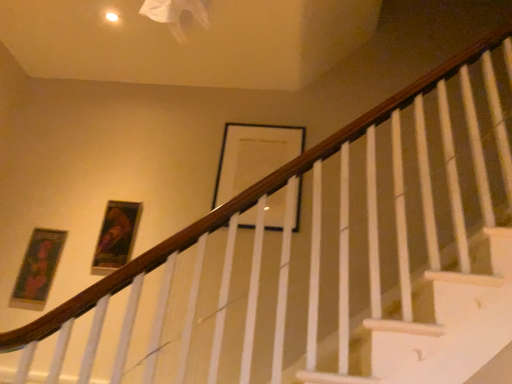
Question: Looking at the image, does black matte picture frame at upper center, which is counted as the third picture frame, starting from the left, seem bigger or smaller compared to matte gold picture frame at left, the first picture frame in the left-to-right sequence?

Choices:
 (A) small
 (B) big

Answer: (B)

Question: Is black matte picture frame at upper center, which is counted as the third picture frame, starting from the left, taller or shorter than matte gold picture frame at left, the first picture frame in the left-to-right sequence?

Choices:
 (A) tall
 (B) short

Answer: (A)

Question: Which of these objects is positioned farthest from the wooden framed portrait at upper left, which appears as the 2th picture frame when viewed from the left?

Choices:
 (A) black matte picture frame at upper center, which is counted as the third picture frame, starting from the left
 (B) matte gold picture frame at left, the first picture frame in the left-to-right sequence

Answer: (A)

Question: Estimate the real-world distances between objects in this image. Which object is farther from the wooden framed portrait at upper left, which ranks as the 2th picture frame in right-to-left order?

Choices:
 (A) black matte picture frame at upper center, which appears as the 1th picture frame when viewed from the right
 (B) matte gold picture frame at left, which is the third picture frame from right to left

Answer: (A)